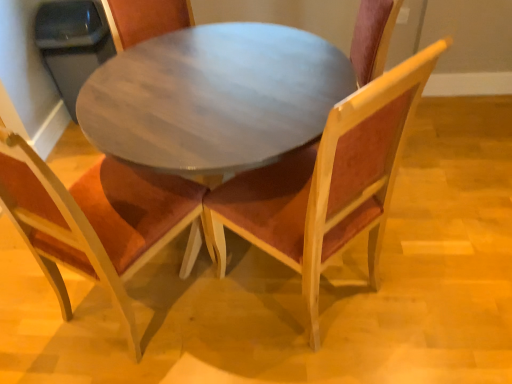
Locate an element on the screen. free space to the right of velvet burgundy chair at center, placed as the second chair when sorted from left to right is located at coordinates (424, 283).